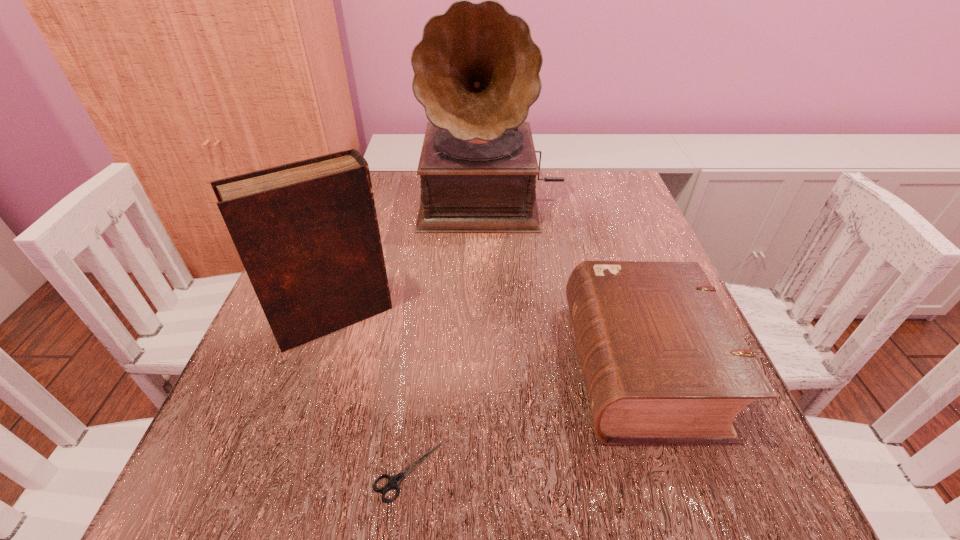
In the image, there is a desktop. Where is `vacant space at the right edge`? This screenshot has width=960, height=540. vacant space at the right edge is located at coordinates (636, 236).

The image size is (960, 540). What are the coordinates of `vacant space at the far right corner` in the screenshot? It's located at (588, 201).

In order to click on unoccupied area between the left Bible and the shears in this screenshot , I will do `click(372, 395)`.

Locate an element on the screen. free point between the right Bible and the tallest object is located at coordinates (x=566, y=282).

Find the location of a particular element. free spot between the shortest object and the record player is located at coordinates (449, 335).

This screenshot has height=540, width=960. In order to click on vacant space in between the tallest object and the taller Bible in this screenshot , I will do `click(413, 258)`.

Where is `free spot between the left Bible and the third tallest object`? free spot between the left Bible and the third tallest object is located at coordinates (488, 342).

Where is `free area in between the second tallest object and the shears`? This screenshot has height=540, width=960. free area in between the second tallest object and the shears is located at coordinates (372, 395).

Where is `vacant region between the shortest object and the left Bible`? This screenshot has height=540, width=960. vacant region between the shortest object and the left Bible is located at coordinates (372, 395).

Find the location of a particular element. This screenshot has width=960, height=540. free space between the record player and the leftmost object is located at coordinates coord(413,258).